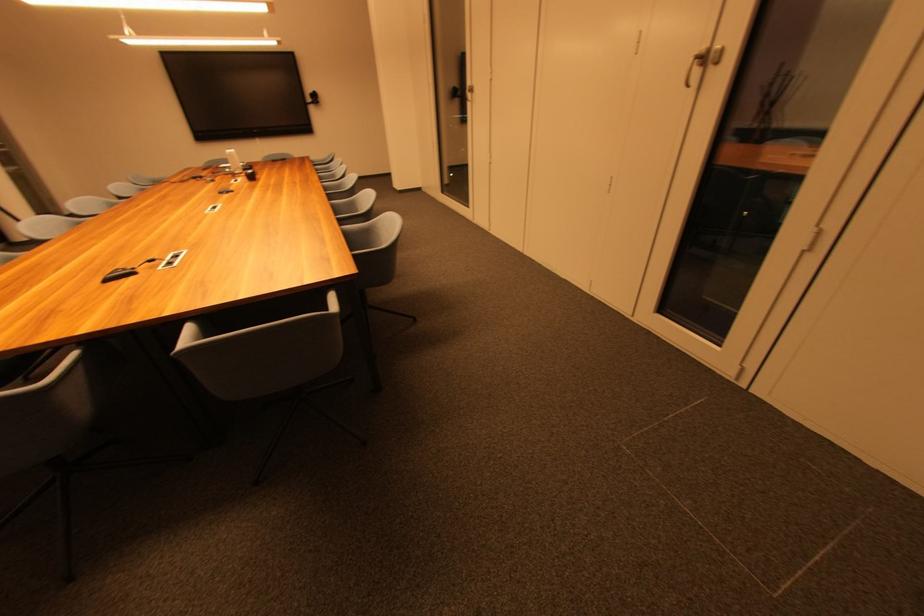
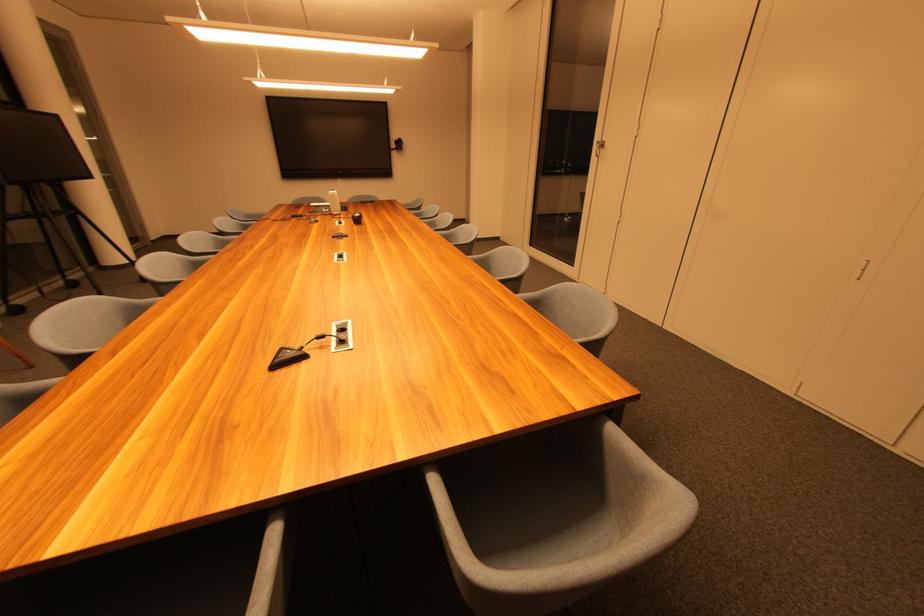
Locate, in the second image, the point that corresponds to [473,84] in the first image.

(602, 140)